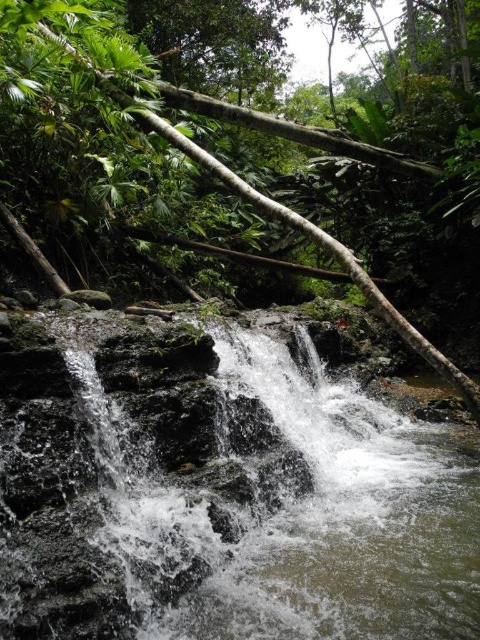
You are a hiker who wants to cross the stream shown in the image. You see the clear water at center and the green rough log at center. Which object is smaller and might be easier to step over while crossing?

The clear water at center is smaller than the green rough log at center, so it might be easier to step over the clear water at center when crossing the stream.

You are standing at the edge of the waterfall and see the clear water at center and the green rough log at center. Which object is closer to you?

The clear water at center is closer to the viewer than the green rough log at center.

You are a hiker who wants to cross the stream at the center. You see the clear water at center and the green rough log at center. Which object should you step on to cross safely?

You should step on the green rough log at center to cross safely because the clear water at center is positioned under it, indicating the log is above the water and provides a stable crossing point.